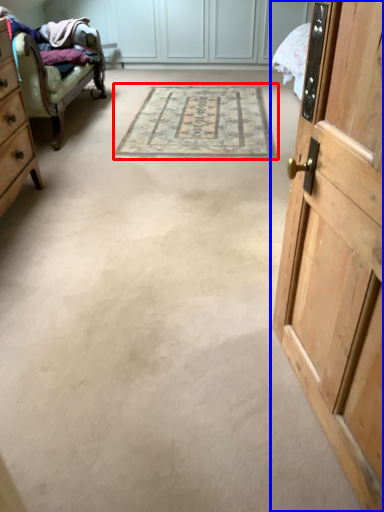
Question: Which point is closer to the camera, mat (highlighted by a red box) or door (highlighted by a blue box)?

Choices:
 (A) mat
 (B) door

Answer: (B)